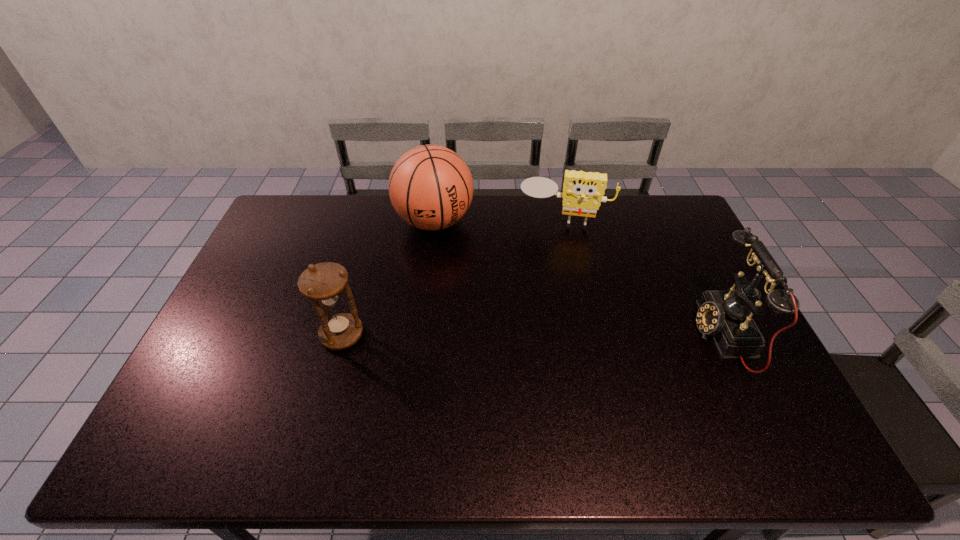
Image resolution: width=960 pixels, height=540 pixels. What are the coordinates of `the leftmost object` in the screenshot? It's located at (323, 283).

Identify the location of the rightmost object. (726, 315).

Find the location of a particular element. The height and width of the screenshot is (540, 960). sponge is located at coordinates (583, 192).

Where is `the third object from right to left`? The image size is (960, 540). the third object from right to left is located at coordinates tap(430, 186).

This screenshot has width=960, height=540. I want to click on free space located on the back of the leftmost object, so click(x=358, y=277).

The image size is (960, 540). In order to click on free space located on the dial of the telephone in this screenshot , I will do `click(575, 335)`.

At what (x,y) coordinates should I click in order to perform the action: click on vacant region located 0.120m on the dial of the telephone. Please return your answer as a coordinate pair (x, y). Image resolution: width=960 pixels, height=540 pixels. Looking at the image, I should click on (657, 335).

Image resolution: width=960 pixels, height=540 pixels. Identify the location of vacant space situated on the dial of the telephone. (642, 335).

Image resolution: width=960 pixels, height=540 pixels. In order to click on vacant space situated on the front-facing side of the sponge in this screenshot , I will do `click(554, 267)`.

Where is `free space located 0.380m on the front-facing side of the sponge`? The height and width of the screenshot is (540, 960). free space located 0.380m on the front-facing side of the sponge is located at coordinates coord(550,313).